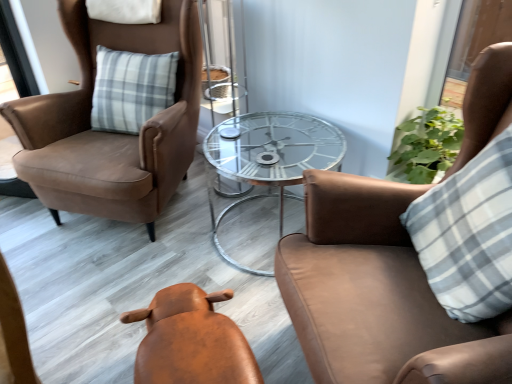
Question: Is suede brown armchair at left, the 3th chair when ordered from right to left, next to leather stool at center, which is counted as the second chair, starting from the left?

Choices:
 (A) no
 (B) yes

Answer: (A)

Question: Is suede brown armchair at left, marked as the first chair in a left-to-right arrangement, facing towards leather stool at center, which is counted as the second chair, starting from the left?

Choices:
 (A) yes
 (B) no

Answer: (B)

Question: From the image's perspective, is suede brown armchair at left, the 3th chair when ordered from right to left, below leather stool at center, which is counted as the second chair, starting from the left?

Choices:
 (A) yes
 (B) no

Answer: (B)

Question: Is suede brown armchair at left, marked as the first chair in a left-to-right arrangement, at the right side of leather stool at center, which is counted as the second chair, starting from the left?

Choices:
 (A) no
 (B) yes

Answer: (A)

Question: Is suede brown armchair at left, marked as the first chair in a left-to-right arrangement, turned away from leather stool at center, which appears as the 2th chair when viewed from the right?

Choices:
 (A) no
 (B) yes

Answer: (A)

Question: From the image's perspective, is suede brown armchair at left, the 3th chair when ordered from right to left, located above or below leather stool at center, which appears as the 2th chair when viewed from the right?

Choices:
 (A) below
 (B) above

Answer: (B)

Question: From a real-world perspective, is suede brown armchair at left, marked as the first chair in a left-to-right arrangement, positioned above or below leather stool at center, which is counted as the second chair, starting from the left?

Choices:
 (A) below
 (B) above

Answer: (B)

Question: Is suede brown armchair at left, marked as the first chair in a left-to-right arrangement, inside the boundaries of leather stool at center, which is counted as the second chair, starting from the left, or outside?

Choices:
 (A) outside
 (B) inside

Answer: (A)

Question: Is suede brown armchair at left, the 3th chair when ordered from right to left, taller or shorter than leather stool at center, which is counted as the second chair, starting from the left?

Choices:
 (A) short
 (B) tall

Answer: (B)

Question: Based on their sizes in the image, would you say white checkered pillow at right is bigger or smaller than brown leather chair at upper right, which appears as the 3th chair when viewed from the left?

Choices:
 (A) small
 (B) big

Answer: (A)

Question: Is white checkered pillow at right in front of or behind brown leather chair at upper right, which ranks as the first chair in right-to-left order, in the image?

Choices:
 (A) behind
 (B) front

Answer: (A)

Question: From a real-world perspective, relative to brown leather chair at upper right, which ranks as the first chair in right-to-left order, is white checkered pillow at right vertically above or below?

Choices:
 (A) above
 (B) below

Answer: (A)

Question: Is white checkered pillow at right situated inside brown leather chair at upper right, which appears as the 3th chair when viewed from the left, or outside?

Choices:
 (A) inside
 (B) outside

Answer: (A)

Question: Is transparent glass table at center taller or shorter than suede brown armchair at left, the 3th chair when ordered from right to left?

Choices:
 (A) tall
 (B) short

Answer: (B)

Question: Is transparent glass table at center wider or thinner than suede brown armchair at left, marked as the first chair in a left-to-right arrangement?

Choices:
 (A) wide
 (B) thin

Answer: (B)